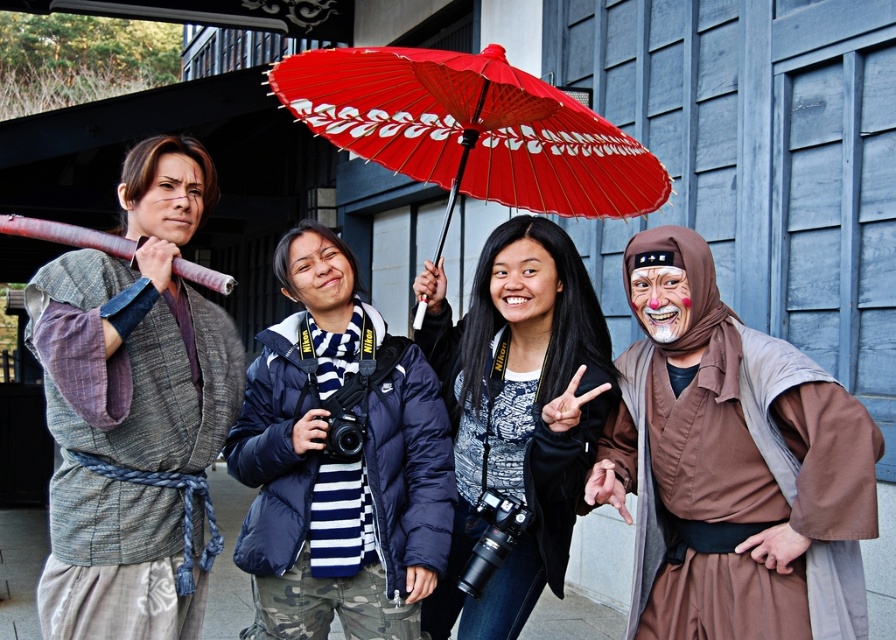
Who is taller, matte gray kimono at left or red paper umbrella at center?

matte gray kimono at left

At what (x,y) coordinates should I click in order to perform the action: click on matte gray kimono at left. Please return your answer as a coordinate pair (x, y). The image size is (896, 640). Looking at the image, I should click on (134, 412).

You are a GUI agent. You are given a task and a screenshot of the screen. Output one action in this format:
    pyautogui.click(x=<x>, y=<y>)
    Task: Click on the matte gray kimono at left
    The height and width of the screenshot is (640, 896).
    Given the screenshot: What is the action you would take?
    pyautogui.click(x=134, y=412)

Is navy blue puffer jacket at center thinner than red paper umbrella at center?

Yes.

Is navy blue puffer jacket at center shorter than red paper umbrella at center?

No, navy blue puffer jacket at center is not shorter than red paper umbrella at center.

Is point (386, 556) closer to camera compared to point (448, 147)?

Yes, point (386, 556) is closer to viewer.

At what (x,y) coordinates should I click in order to perform the action: click on navy blue puffer jacket at center. Please return your answer as a coordinate pair (x, y). The width and height of the screenshot is (896, 640). Looking at the image, I should click on (337, 465).

Does brown fabric mask at right have a greater width compared to matte black jacket at center?

Yes, brown fabric mask at right is wider than matte black jacket at center.

Is brown fabric mask at right thinner than matte black jacket at center?

Incorrect, brown fabric mask at right's width is not less than matte black jacket at center's.

Image resolution: width=896 pixels, height=640 pixels. What do you see at coordinates (731, 465) in the screenshot?
I see `brown fabric mask at right` at bounding box center [731, 465].

Image resolution: width=896 pixels, height=640 pixels. In order to click on brown fabric mask at right in this screenshot , I will do `click(731, 465)`.